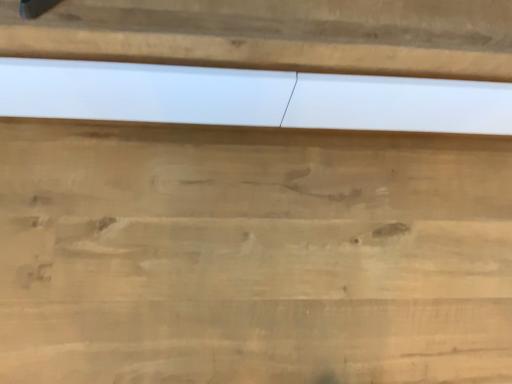
Image resolution: width=512 pixels, height=384 pixels. Describe the element at coordinates (252, 254) in the screenshot. I see `natural wood cutting board at center` at that location.

What is the approximate height of natural wood cutting board at center?

It is 3.81 inches.

In order to face natural wood cutting board at center, should I rotate leftwards or rightwards?

Turn right approximately 2.516 degrees to face it.

I want to click on natural wood cutting board at center, so point(252,254).

What is the approximate width of natural wood cutting board at center?

The width of natural wood cutting board at center is 1.36 meters.

Measure the distance between point [85,175] and camera.

3.31 feet.

The image size is (512, 384). What do you see at coordinates (276, 35) in the screenshot?
I see `white matte panel at center` at bounding box center [276, 35].

At what (x,y) coordinates should I click in order to perform the action: click on white matte panel at center. Please return your answer as a coordinate pair (x, y). The height and width of the screenshot is (384, 512). Looking at the image, I should click on (276, 35).

What is the approximate height of white matte panel at center?

white matte panel at center is 16.55 inches in height.

Where is `natural wood cutting board at center`? Image resolution: width=512 pixels, height=384 pixels. natural wood cutting board at center is located at coordinates (252, 254).

Which is more to the right, natural wood cutting board at center or white matte panel at center?

→ Positioned to the right is white matte panel at center.

Looking at this image, considering the positions of objects natural wood cutting board at center and white matte panel at center in the image provided, who is in front, natural wood cutting board at center or white matte panel at center?

white matte panel at center is closer to the camera.

Which point is more forward, (93, 194) or (252, 37)?

The point (252, 37) is more forward.

From the image's perspective, is natural wood cutting board at center on top of white matte panel at center?

No, from the image's perspective, natural wood cutting board at center is not over white matte panel at center.

From a real-world perspective, between natural wood cutting board at center and white matte panel at center, who is vertically lower?

In real-world perspective, natural wood cutting board at center is lower.

Which object is thinner, natural wood cutting board at center or white matte panel at center?

white matte panel at center.

Can you confirm if natural wood cutting board at center is taller than white matte panel at center?

In fact, natural wood cutting board at center may be shorter than white matte panel at center.

Who is bigger, natural wood cutting board at center or white matte panel at center?

white matte panel at center.

Is white matte panel at center surrounded by natural wood cutting board at center?

No, white matte panel at center is not inside natural wood cutting board at center.

Based on the photo, is natural wood cutting board at center positioned far away from white matte panel at center?

No, natural wood cutting board at center is not far away from white matte panel at center.

From the picture: Is natural wood cutting board at center turned away from white matte panel at center?

natural wood cutting board at center is not turned away from white matte panel at center.

What's the angular difference between natural wood cutting board at center and white matte panel at center's facing directions?

There is a 89.1-degree angle between the facing directions of natural wood cutting board at center and white matte panel at center.

How distant is natural wood cutting board at center from white matte panel at center?

natural wood cutting board at center and white matte panel at center are 16.84 inches apart.

Locate an element on the screen. This screenshot has height=384, width=512. panel on the right of natural wood cutting board at center is located at coordinates (276, 35).

Visually, is white matte panel at center positioned to the left or to the right of natural wood cutting board at center?

white matte panel at center is to the right of natural wood cutting board at center.

In the image, is white matte panel at center positioned in front of or behind natural wood cutting board at center?

white matte panel at center is in front of natural wood cutting board at center.

Considering the positions of points (328, 14) and (291, 350), is point (328, 14) closer to camera compared to point (291, 350)?

Yes, it is.

From the image's perspective, between white matte panel at center and natural wood cutting board at center, which one is located above?

white matte panel at center.

From a real-world perspective, who is located higher, white matte panel at center or natural wood cutting board at center?

white matte panel at center is physically above.

From the picture: Considering the sizes of white matte panel at center and natural wood cutting board at center in the image, is white matte panel at center wider or thinner than natural wood cutting board at center?

In the image, white matte panel at center appears to be more narrow than natural wood cutting board at center.

Can you confirm if white matte panel at center is shorter than natural wood cutting board at center?

No, white matte panel at center is not shorter than natural wood cutting board at center.

Does white matte panel at center have a larger size compared to natural wood cutting board at center?

Yes, white matte panel at center is bigger than natural wood cutting board at center.

Would you say natural wood cutting board at center is part of white matte panel at center's contents?

No, natural wood cutting board at center is not surrounded by white matte panel at center.

Is white matte panel at center placed right next to natural wood cutting board at center?

white matte panel at center and natural wood cutting board at center are not in contact.

Is natural wood cutting board at center at the back of white matte panel at center?

No.

How different are the orientations of white matte panel at center and natural wood cutting board at center in degrees?

They differ by 89.1 degrees in their facing directions.

From the picture: How much distance is there between white matte panel at center and natural wood cutting board at center?

white matte panel at center is 16.84 inches from natural wood cutting board at center.

Find the location of a particular element. cutting board directly beneath the white matte panel at center (from a real-world perspective) is located at coordinates (252, 254).

Locate an element on the screen. panel in front of the natural wood cutting board at center is located at coordinates (276, 35).

You are a GUI agent. You are given a task and a screenshot of the screen. Output one action in this format:
    pyautogui.click(x=<x>, y=<y>)
    Task: Click on the cutting board below the white matte panel at center (from the image's perspective)
    The image size is (512, 384).
    Given the screenshot: What is the action you would take?
    pyautogui.click(x=252, y=254)